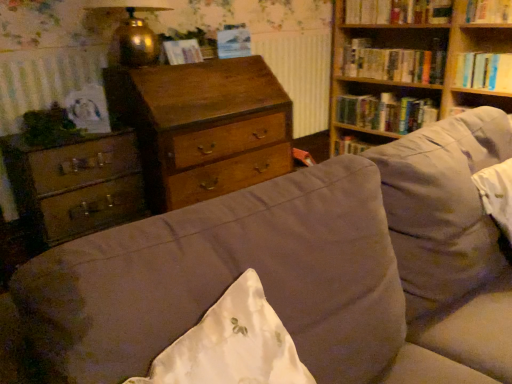
Question: In the image, is suede-like beige couch at center positioned in front of or behind matte paper at upper center, the 1th paperback book from the back?

Choices:
 (A) behind
 (B) front

Answer: (B)

Question: Is suede-like beige couch at center situated inside matte paper at upper center, which appears as the second paperback book when viewed from the left, or outside?

Choices:
 (A) inside
 (B) outside

Answer: (B)

Question: Estimate the real-world distances between objects in this image. Which object is closer to the wooden bookshelf at upper right?

Choices:
 (A) matte paper at center, the first paperback book viewed from the front
 (B) wooden chest of drawers at center, marked as the 2th chest of drawers in a left-to-right arrangement
 (C) matte paper at upper center, which is counted as the second paperback book, starting from the front
 (D) wooden chest of drawers at left, acting as the 1th chest of drawers starting from the left
 (E) hardcover books at upper right, which is the 2th book in top-to-bottom order

Answer: (E)

Question: Which is nearer to the wooden bookshelf at upper right?

Choices:
 (A) wooden chest of drawers at left, acting as the 1th chest of drawers starting from the left
 (B) hardcover book at upper right, the fourth book viewed from the top
 (C) wooden bookshelf at upper right
 (D) matte paper at upper center, which appears as the second paperback book when viewed from the left
 (E) wooden chest of drawers at center, the 1th chest of drawers viewed from the right

Answer: (C)